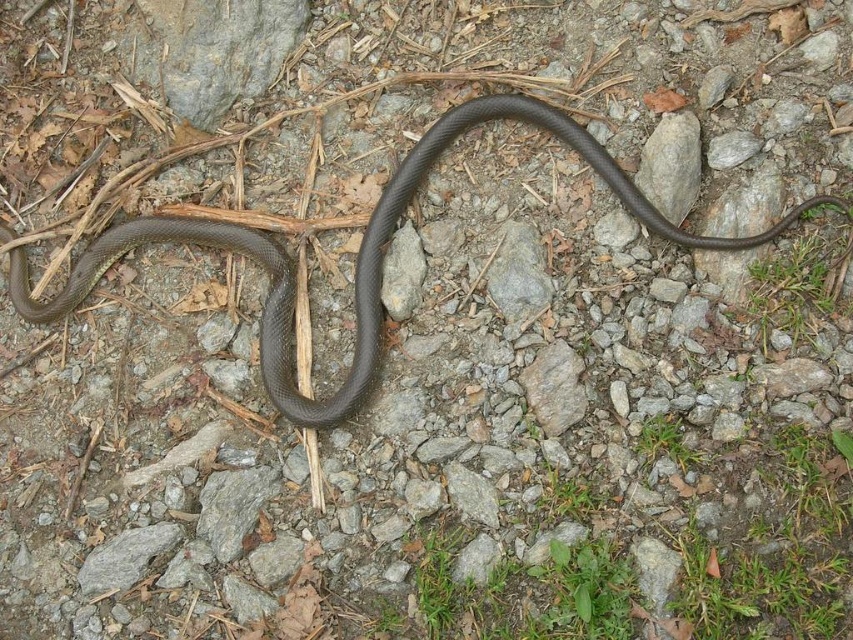
You are a wildlife photographer trying to capture a closeup of the shiny black snake at center. You notice a gray rough rock at center in the way. Can you tell me which object is bigger so I can decide which to move?

The shiny black snake at center is larger in size than the gray rough rock at center, so you should move the gray rough rock at center to get a clear shot of the snake.

You are a wildlife photographer aiming to capture the shiny black snake at center and the gray rough rock at center in the same frame. Based on their heights, which object will appear larger in the photo?

The shiny black snake at center is taller than the gray rough rock at center, so it will appear larger in the photo.

You are a wildlife photographer aiming to capture a closeup of the shiny black snake at center. You have a camera with a 100mm lens that requires a minimum distance of 20 inches between the camera and the subject to focus properly. There is a gray rough rock at center in the way. Can you focus on the snake without moving the rock?

The shiny black snake at center and gray rough rock at center are 20.37 inches apart. Since the minimum focusing distance is 20 inches, you can focus on the snake as the distance between them is just over the required 20 inches.